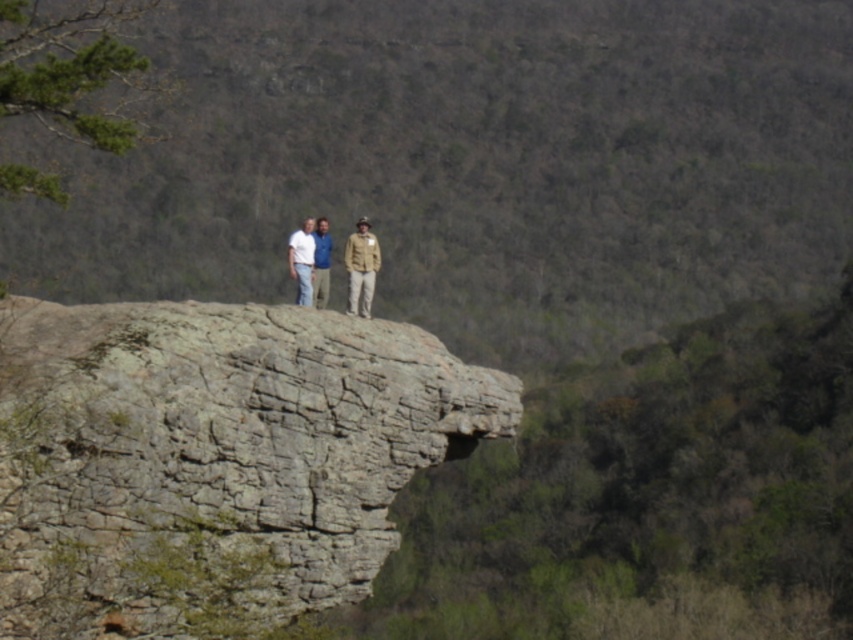
You are standing at the point marked as point (469,164) in the image. What object is located exactly at that point?

The gray rock formation at center is located exactly at point (469,164).

You are a hiker who wants to take a photo of the gray rock formation at center and the khaki fabric jacket at center. Which object should you focus on first if you want to capture both in the frame without moving the camera?

You should focus on the khaki fabric jacket at center first because the gray rock formation at center is positioned to the right of it, so by centering the jacket, the rock will naturally be in the frame to its right without needing to adjust the camera position.

You are standing at the edge of the rock formation and want to place a small flag at the point closer to you between the two points marked as point (326, 492) and point (309, 221). Which point should you choose?

You should choose point (326, 492) because it is closer to the viewer than point (309, 221).